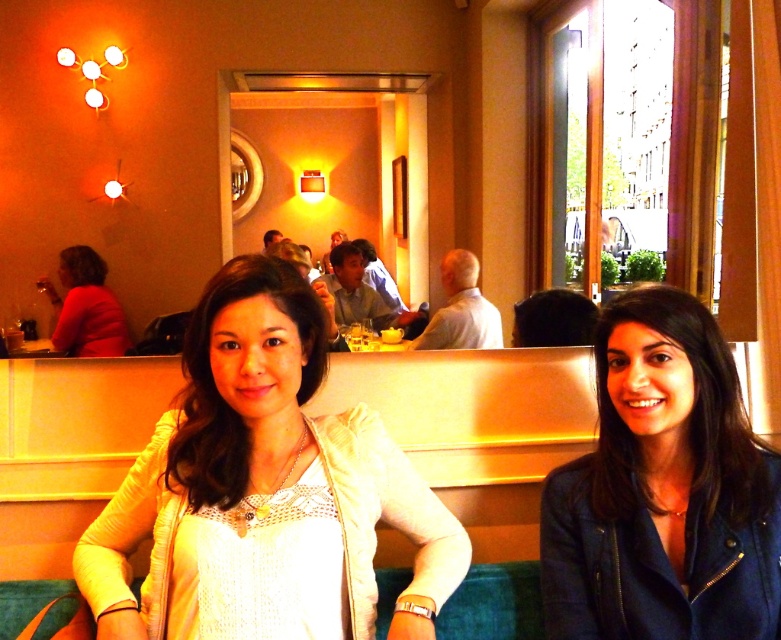
What do you see at coordinates (662, 490) in the screenshot? This screenshot has height=640, width=781. I see `dark blue leather jacket at lower right` at bounding box center [662, 490].

Who is higher up, dark blue leather jacket at lower right or matte red shirt at left?

matte red shirt at left is above.

Where is `dark blue leather jacket at lower right`? This screenshot has height=640, width=781. dark blue leather jacket at lower right is located at coordinates (662, 490).

In order to click on dark blue leather jacket at lower right in this screenshot , I will do `click(662, 490)`.

Is white lace top at center positioned before matte red shirt at left?

Yes, white lace top at center is in front of matte red shirt at left.

Does white lace top at center have a lesser height compared to matte red shirt at left?

No.

Image resolution: width=781 pixels, height=640 pixels. Find the location of `white lace top at center`. white lace top at center is located at coordinates (264, 490).

Can you confirm if white lace top at center is positioned to the right of dark blue leather jacket at lower right?

No, white lace top at center is not to the right of dark blue leather jacket at lower right.

Which is above, white lace top at center or dark blue leather jacket at lower right?

Positioned higher is white lace top at center.

Which is in front, point (270, 268) or point (617, 628)?

Point (617, 628) is more forward.

Identify the location of white lace top at center. (264, 490).